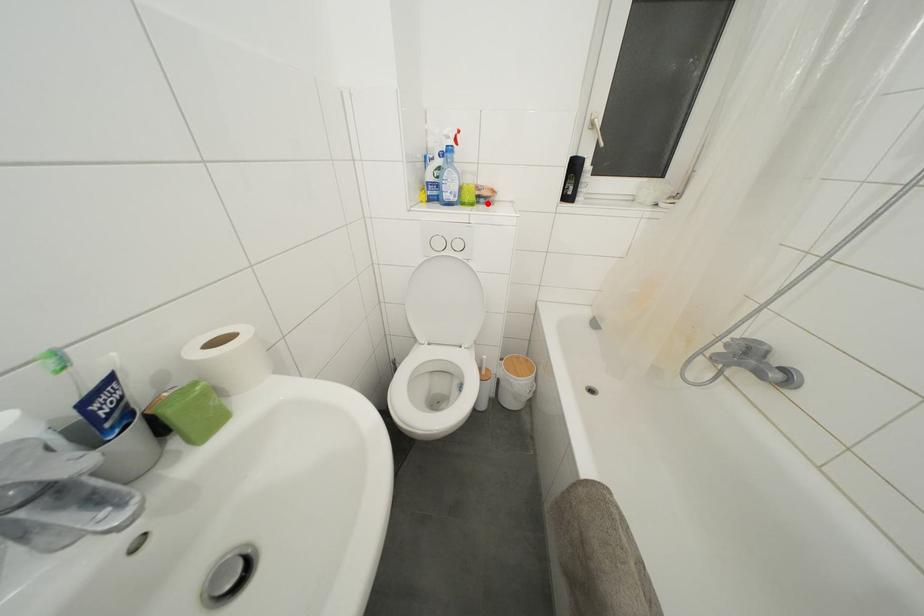
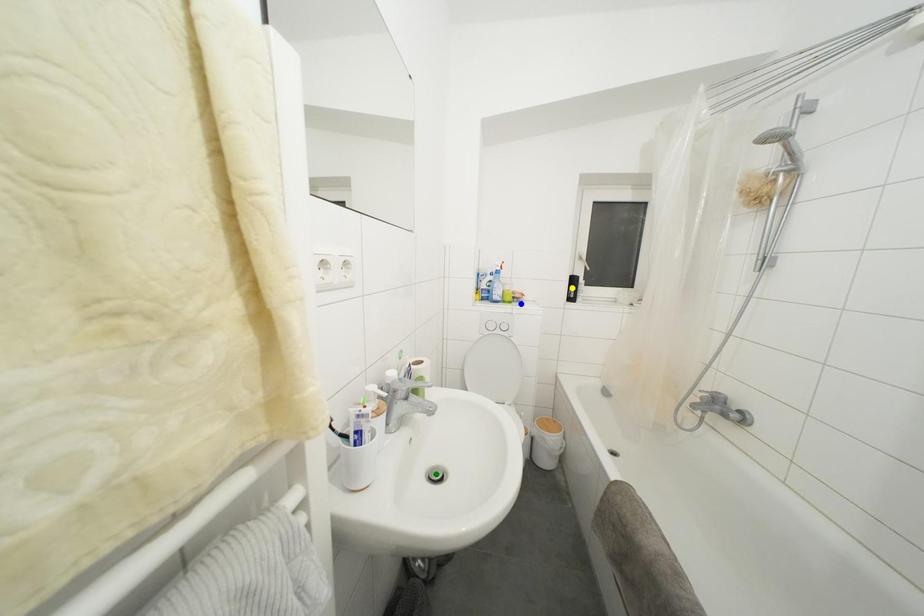
Question: I am providing you with two images of the same scene from different viewpoints. A red point is marked on the first image. You are given multiple points on the second image. In image 2, which mark is for the same physical point as the one in image 1?

Choices:
 (A) blue point
 (B) yellow point
 (C) green point

Answer: (A)